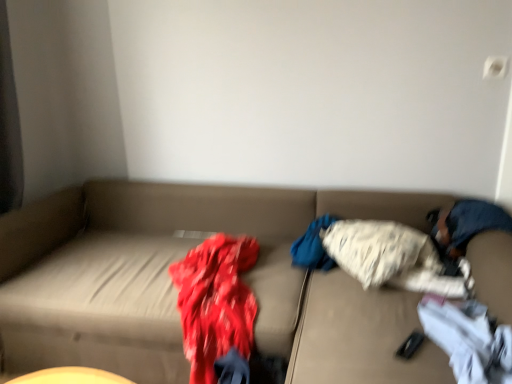
The image size is (512, 384). What do you see at coordinates (465, 224) in the screenshot?
I see `blue denim jeans at right` at bounding box center [465, 224].

What do you see at coordinates (175, 290) in the screenshot? This screenshot has width=512, height=384. I see `beige fabric couch at center` at bounding box center [175, 290].

Image resolution: width=512 pixels, height=384 pixels. Find the location of `fluffy white blanket at center, which is counted as the 1th clothing, starting from the back`. fluffy white blanket at center, which is counted as the 1th clothing, starting from the back is located at coordinates (392, 257).

Locate an element on the screen. studio couch on the left of fluffy white blanket at center, which is counted as the 1th clothing, starting from the back is located at coordinates (175, 290).

Is beige fabric couch at center turned away from fluffy white blanket at center, the second clothing from the front?

Correct, beige fabric couch at center is looking away from fluffy white blanket at center, the second clothing from the front.

From the picture: Who is bigger, beige fabric couch at center or fluffy white blanket at center, the second clothing from the front?

With larger size is beige fabric couch at center.

Choose the correct answer: Is beige fabric couch at center inside fluffy white blanket at center, which is counted as the 1th clothing, starting from the back, or outside it?

beige fabric couch at center is outside fluffy white blanket at center, which is counted as the 1th clothing, starting from the back.

Is blue denim jeans at right shorter than white cotton socks at lower right, which is the 2th clothing in back-to-front order?

Incorrect, the height of blue denim jeans at right does not fall short of that of white cotton socks at lower right, which is the 2th clothing in back-to-front order.

Does blue denim jeans at right have a lesser width compared to white cotton socks at lower right, the first clothing from the front?

No.

Is blue denim jeans at right positioned far away from white cotton socks at lower right, which is the 2th clothing in back-to-front order?

That's not correct — blue denim jeans at right is a little close to white cotton socks at lower right, which is the 2th clothing in back-to-front order.

From the image's perspective, is blue denim jeans at right on top of white cotton socks at lower right, the first clothing from the front?

Correct, blue denim jeans at right appears higher than white cotton socks at lower right, the first clothing from the front, in the image.

Is fluffy white blanket at center, the second clothing from the front, touching white cotton socks at lower right, which is the 2th clothing in back-to-front order?

They are not placed beside each other.

Is fluffy white blanket at center, which is counted as the 1th clothing, starting from the back, to the left or to the right of white cotton socks at lower right, the first clothing from the front, in the image?

fluffy white blanket at center, which is counted as the 1th clothing, starting from the back, is to the left of white cotton socks at lower right, the first clothing from the front.

Is fluffy white blanket at center, which is counted as the 1th clothing, starting from the back, bigger or smaller than white cotton socks at lower right, which is the 2th clothing in back-to-front order?

In the image, fluffy white blanket at center, which is counted as the 1th clothing, starting from the back, appears to be larger than white cotton socks at lower right, which is the 2th clothing in back-to-front order.

The width and height of the screenshot is (512, 384). I want to click on person on the right of beige fabric couch at center, so click(x=465, y=224).

From the picture: Relative to blue denim jeans at right, is beige fabric couch at center in front or behind?

beige fabric couch at center is in front of blue denim jeans at right.

Does beige fabric couch at center have a lesser height compared to blue denim jeans at right?

In fact, beige fabric couch at center may be taller than blue denim jeans at right.

Which is more to the left, beige fabric couch at center or white cotton socks at lower right, the first clothing from the front?

beige fabric couch at center is more to the left.

You are a GUI agent. You are given a task and a screenshot of the screen. Output one action in this format:
    pyautogui.click(x=<x>, y=<y>)
    Task: Click on the studio couch in front of the white cotton socks at lower right, which is the 2th clothing in back-to-front order
    
    Given the screenshot: What is the action you would take?
    (175, 290)

Considering the relative sizes of beige fabric couch at center and white cotton socks at lower right, which is the 2th clothing in back-to-front order, in the image provided, is beige fabric couch at center shorter than white cotton socks at lower right, which is the 2th clothing in back-to-front order,?

No, beige fabric couch at center is not shorter than white cotton socks at lower right, which is the 2th clothing in back-to-front order.

Is beige fabric couch at center not inside white cotton socks at lower right, which is the 2th clothing in back-to-front order?

That's correct, beige fabric couch at center is outside of white cotton socks at lower right, which is the 2th clothing in back-to-front order.

Between fluffy white blanket at center, the second clothing from the front, and beige fabric couch at center, which one has more height?

With more height is beige fabric couch at center.

From the image's perspective, relative to beige fabric couch at center, is fluffy white blanket at center, which is counted as the 1th clothing, starting from the back, above or below?

fluffy white blanket at center, which is counted as the 1th clothing, starting from the back, is above beige fabric couch at center.

Find the location of a particular element. studio couch lying below the fluffy white blanket at center, the second clothing from the front (from the image's perspective) is located at coordinates (175, 290).

How different are the orientations of fluffy white blanket at center, which is counted as the 1th clothing, starting from the back, and beige fabric couch at center in degrees?

22.1 degrees separate the facing orientations of fluffy white blanket at center, which is counted as the 1th clothing, starting from the back, and beige fabric couch at center.

Is white cotton socks at lower right, the first clothing from the front, positioned far away from blue denim jeans at right?

No, there isn't a large distance between white cotton socks at lower right, the first clothing from the front, and blue denim jeans at right.

From the image's perspective, which is below, white cotton socks at lower right, which is the 2th clothing in back-to-front order, or blue denim jeans at right?

white cotton socks at lower right, which is the 2th clothing in back-to-front order, from the image's perspective.

At what (x,y) coordinates should I click in order to perform the action: click on clothing in front of the blue denim jeans at right. Please return your answer as a coordinate pair (x, y). The image size is (512, 384). Looking at the image, I should click on (468, 340).

Does point (456, 313) come farther from viewer compared to point (463, 226)?

No.

In the image, there is a fluffy white blanket at center, which is counted as the 1th clothing, starting from the back. At what (x,y) coordinates should I click in order to perform the action: click on studio couch below it (from the image's perspective). Please return your answer as a coordinate pair (x, y). Image resolution: width=512 pixels, height=384 pixels. Looking at the image, I should click on (175, 290).

Find the location of a particular element. The width and height of the screenshot is (512, 384). the 2nd clothing positioned below the blue denim jeans at right (from a real-world perspective) is located at coordinates (468, 340).

Looking at the image, which one is located further to beige fabric couch at center, fluffy white blanket at center, which is counted as the 1th clothing, starting from the back, or blue denim jeans at right?

blue denim jeans at right.

Considering their positions, is beige fabric couch at center positioned closer to fluffy white blanket at center, which is counted as the 1th clothing, starting from the back, than blue denim jeans at right?

Based on the image, blue denim jeans at right appears to be nearer to fluffy white blanket at center, which is counted as the 1th clothing, starting from the back.

When comparing their distances from beige fabric couch at center, does fluffy white blanket at center, which is counted as the 1th clothing, starting from the back, or white cotton socks at lower right, which is the 2th clothing in back-to-front order, seem further?

white cotton socks at lower right, which is the 2th clothing in back-to-front order, lies further to beige fabric couch at center than the other object.

Looking at the image, which one is located closer to white cotton socks at lower right, which is the 2th clothing in back-to-front order, fluffy white blanket at center, the second clothing from the front, or beige fabric couch at center?

fluffy white blanket at center, the second clothing from the front, lies closer to white cotton socks at lower right, which is the 2th clothing in back-to-front order, than the other object.

From the image, which object appears to be farther from blue denim jeans at right, fluffy white blanket at center, the second clothing from the front, or white cotton socks at lower right, which is the 2th clothing in back-to-front order?

white cotton socks at lower right, which is the 2th clothing in back-to-front order, is positioned further to the anchor blue denim jeans at right.

Estimate the real-world distances between objects in this image. Which object is closer to beige fabric couch at center, white cotton socks at lower right, which is the 2th clothing in back-to-front order, or blue denim jeans at right?

Among the two, white cotton socks at lower right, which is the 2th clothing in back-to-front order, is located nearer to beige fabric couch at center.

Considering their positions, is beige fabric couch at center positioned closer to white cotton socks at lower right, the first clothing from the front, than blue denim jeans at right?

Among the two, blue denim jeans at right is located nearer to white cotton socks at lower right, the first clothing from the front.

When comparing their distances from beige fabric couch at center, does blue denim jeans at right or white cotton socks at lower right, the first clothing from the front, seem closer?

white cotton socks at lower right, the first clothing from the front, is closer to beige fabric couch at center.

Identify the location of person between white cotton socks at lower right, which is the 2th clothing in back-to-front order, and fluffy white blanket at center, the second clothing from the front, in the front-back direction. The height and width of the screenshot is (384, 512). (465, 224).

The width and height of the screenshot is (512, 384). Identify the location of person between beige fabric couch at center and fluffy white blanket at center, which is counted as the 1th clothing, starting from the back, in the front-back direction. click(x=465, y=224).

At what (x,y) coordinates should I click in order to perform the action: click on clothing between beige fabric couch at center and fluffy white blanket at center, the second clothing from the front, along the z-axis. Please return your answer as a coordinate pair (x, y). The height and width of the screenshot is (384, 512). Looking at the image, I should click on (468, 340).